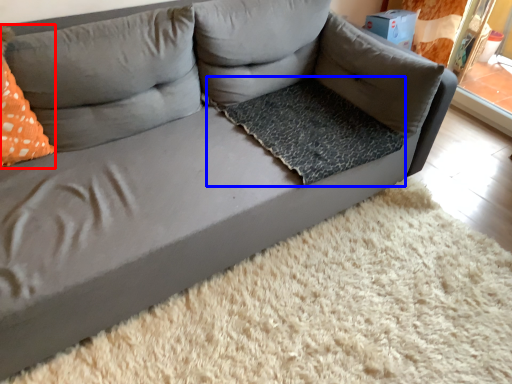
Question: Which point is closer to the camera, throw pillow (highlighted by a red box) or dog bed (highlighted by a blue box)?

Choices:
 (A) throw pillow
 (B) dog bed

Answer: (A)